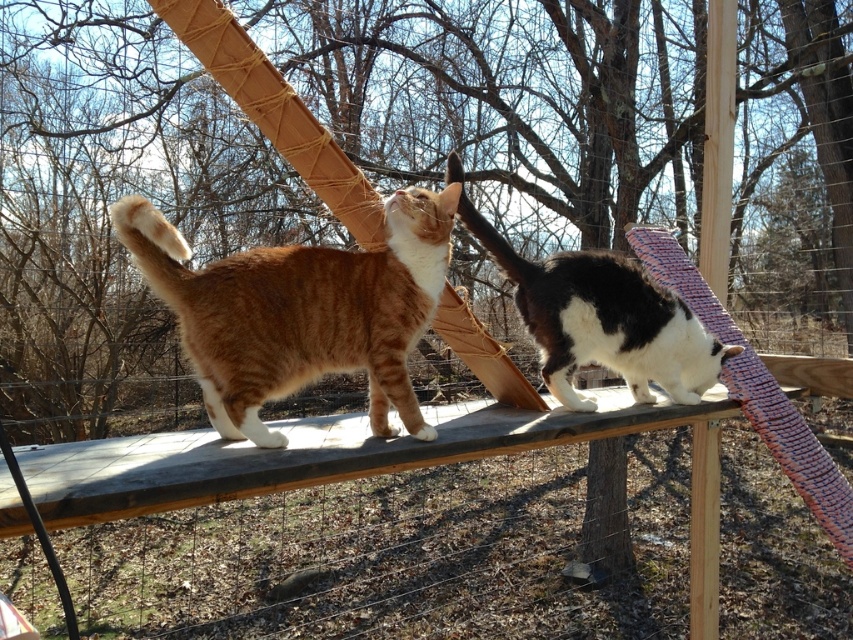
Does orange tabby cat at center appear on the left side of black and white fur cat at center?

Indeed, orange tabby cat at center is positioned on the left side of black and white fur cat at center.

Based on the photo, is orange tabby cat at center further to the viewer compared to black and white fur cat at center?

No, it is in front of black and white fur cat at center.

Find the location of `orange tabby cat at center`. orange tabby cat at center is located at coordinates (300, 310).

I want to click on orange tabby cat at center, so click(300, 310).